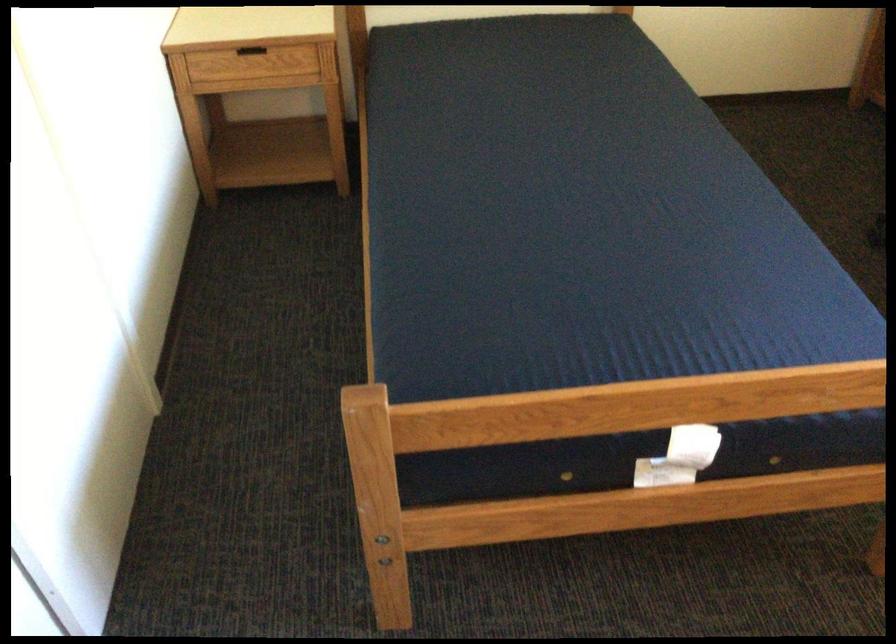
Where is `blue bed surface`? blue bed surface is located at coordinates (378, 140).